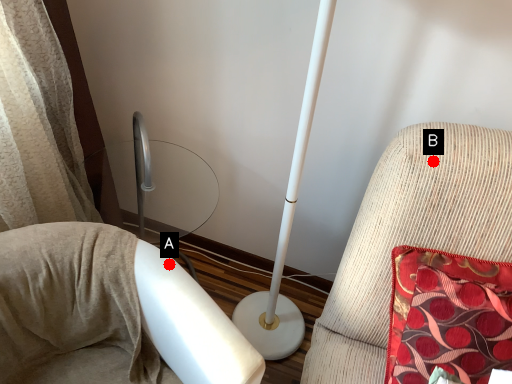
Question: Two points are circled on the image, labeled by A and B beside each circle. Which point is closer to the camera?

Choices:
 (A) A is closer
 (B) B is closer

Answer: (B)